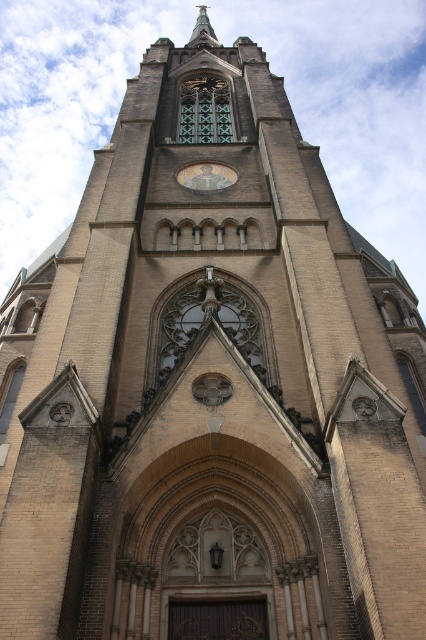
You are a tourist standing in front of the historic church and want to take a photo of the gold metallic clock at center and the polished gold spire at upper center. Which object should you focus on first if you want to capture both in a single frame without moving the camera?

You should focus on the gold metallic clock at center first because it is positioned under the polished gold spire at upper center, so adjusting the camera to include the lower clock will naturally include the spire above it in the frame.

Based on the photo, you are standing in front of the church and want to know which object is taller between the gold metallic clock at center and the polished gold spire at upper center. Based on their positions, can you determine which one is taller?

The gold metallic clock at center is shorter than the polished gold spire at upper center, so the polished gold spire at upper center is taller.

You are an architect evaluating the church facade. You notice the gold metallic clock at center and the polished gold spire at upper center. Which of these two elements is larger in size?

The gold metallic clock at center is smaller than the polished gold spire at upper center, so the polished gold spire at upper center is larger in size.